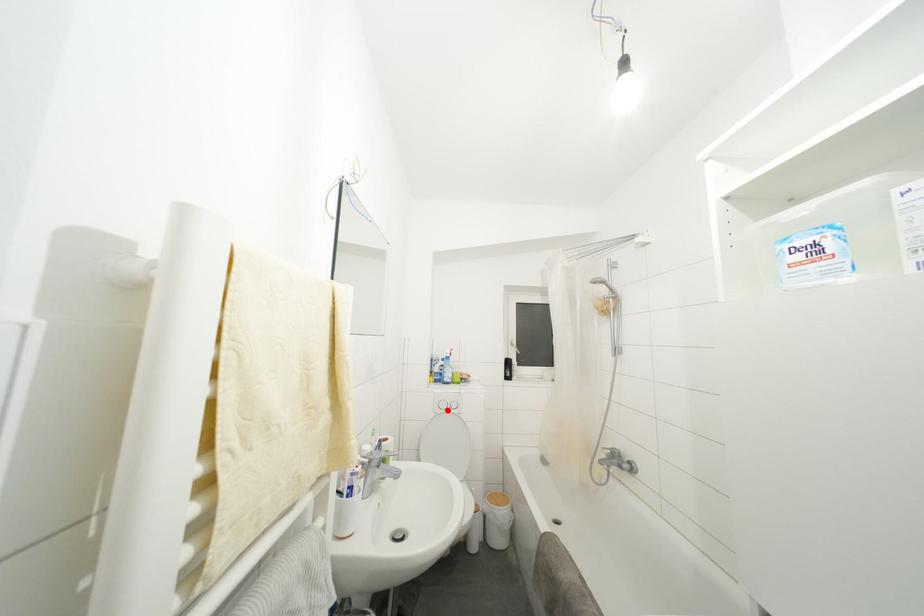
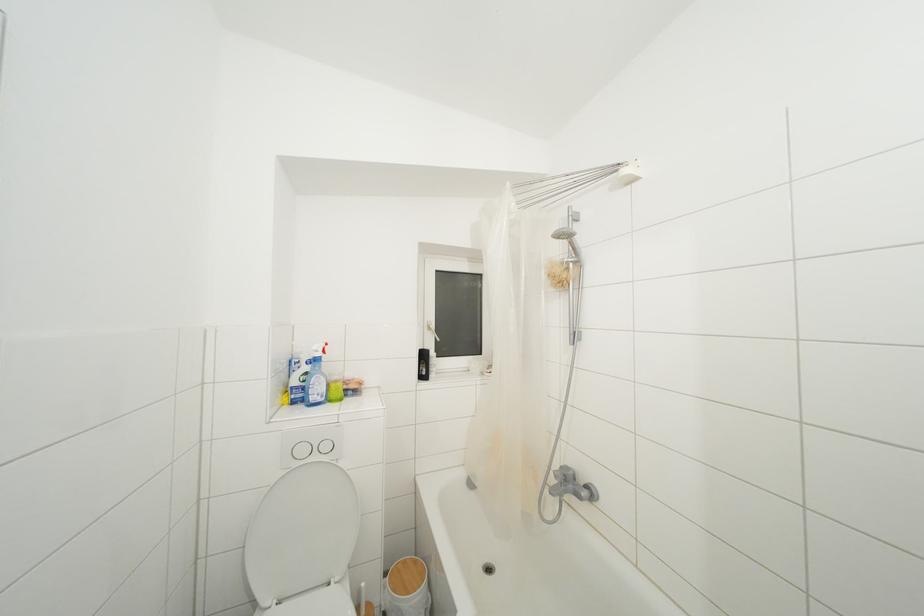
Locate, in the second image, the point that corresponds to the highlighted location in the first image.

(307, 456)